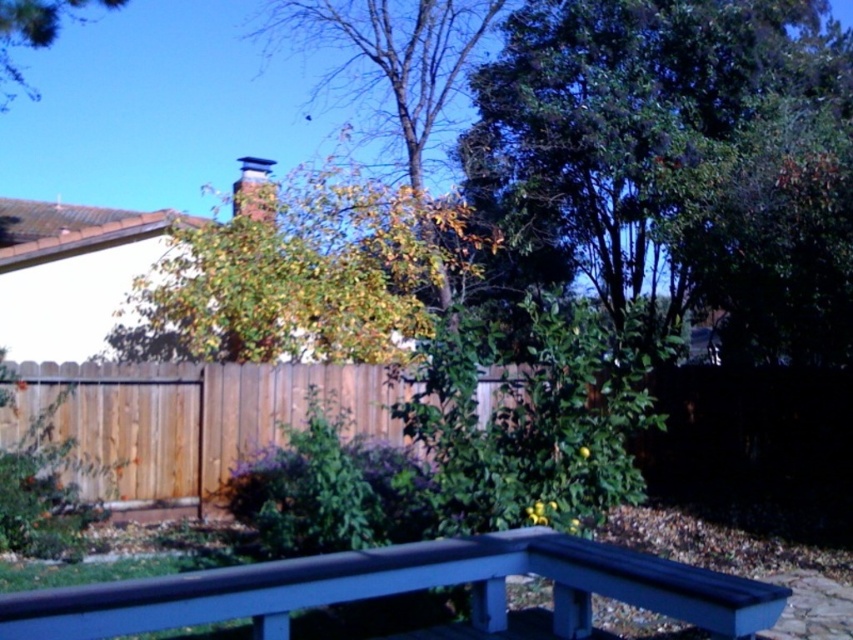
Question: Can you confirm if smooth blue bench at lower center is smaller than green matte tree at upper left?

Choices:
 (A) no
 (B) yes

Answer: (B)

Question: Can you confirm if green leafy tree at upper right is positioned to the left of brown wood fence at center?

Choices:
 (A) no
 (B) yes

Answer: (A)

Question: Which point is farther from the camera taking this photo?

Choices:
 (A) (456, 54)
 (B) (786, 211)
 (C) (45, 33)

Answer: (A)

Question: Is the position of green leafy tree at upper right more distant than that of green matte tree at upper left?

Choices:
 (A) yes
 (B) no

Answer: (B)

Question: Which point appears closest to the camera in this image?

Choices:
 (A) (184, 499)
 (B) (656, 579)
 (C) (3, 4)

Answer: (B)

Question: Which point is closer to the camera?

Choices:
 (A) (276, 608)
 (B) (370, 81)
 (C) (489, 380)
 (D) (3, 54)

Answer: (A)